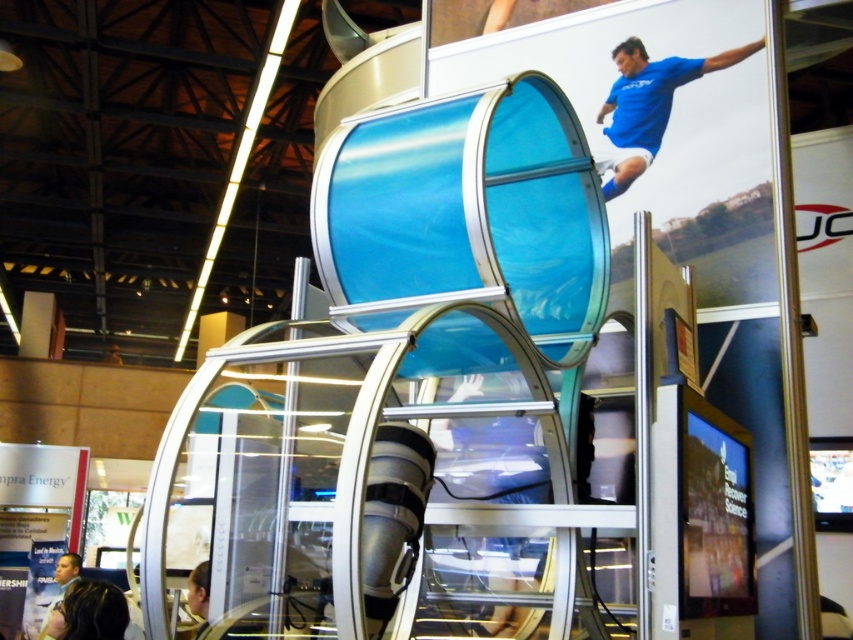
Question: Does blue jersey at upper right appear on the right side of dark brown hair at lower left?

Choices:
 (A) no
 (B) yes

Answer: (B)

Question: Is blue jersey at upper right below dark brown hair at lower left?

Choices:
 (A) yes
 (B) no

Answer: (B)

Question: Which of the following is the closest to the observer?

Choices:
 (A) blue jersey at upper right
 (B) dark brown hair at lower left

Answer: (A)

Question: Can you confirm if blue jersey at upper right is thinner than dark brown hair at lower left?

Choices:
 (A) no
 (B) yes

Answer: (B)